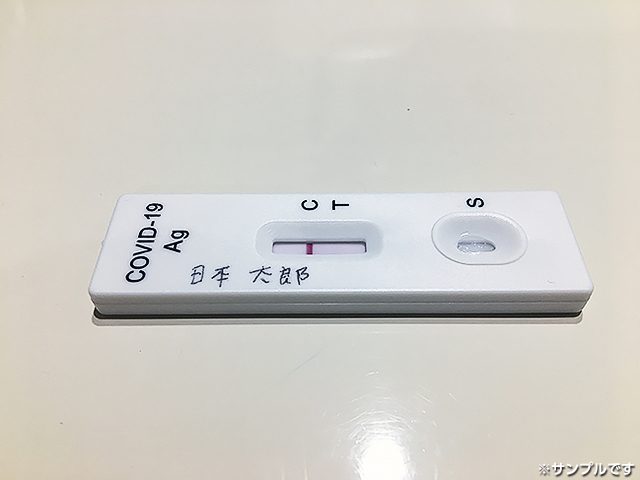
Identify the location of counter. Image resolution: width=640 pixels, height=480 pixels. (493, 378).